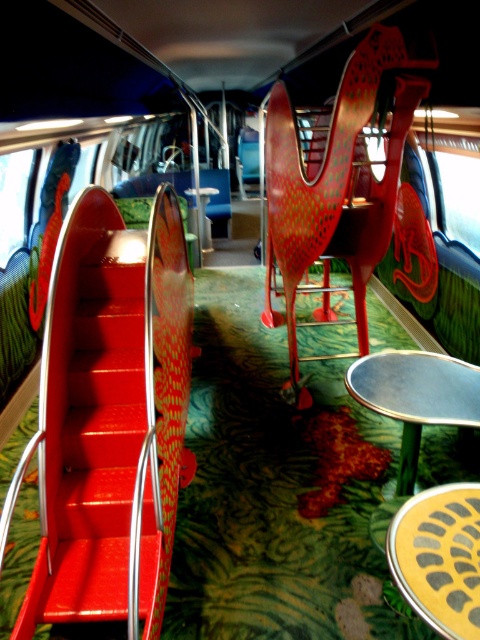
Between point (108, 200) and point (370, 189), which one is positioned behind?

Point (108, 200)

The width and height of the screenshot is (480, 640). In order to click on shiny red slide at left in this screenshot , I will do `click(110, 419)`.